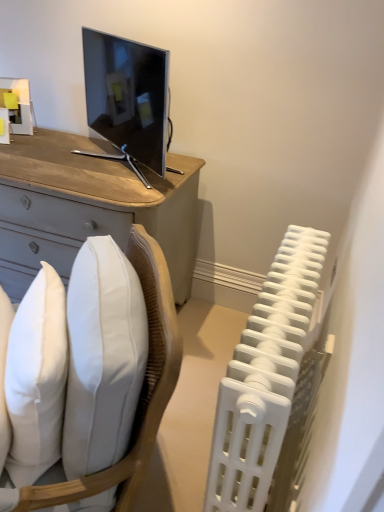
Question: From the image's perspective, is white fabric chair at lower left above or below white plastic radiator at right?

Choices:
 (A) below
 (B) above

Answer: (B)

Question: Is white fabric chair at lower left situated inside white plastic radiator at right or outside?

Choices:
 (A) outside
 (B) inside

Answer: (A)

Question: Based on their relative distances, which object is nearer to the white plastic radiator at right?

Choices:
 (A) white soft pillow at lower left
 (B) white fabric chair at lower left

Answer: (B)

Question: Considering the real-world distances, which object is closest to the white plastic radiator at right?

Choices:
 (A) white fabric chair at lower left
 (B) white soft pillow at lower left

Answer: (A)